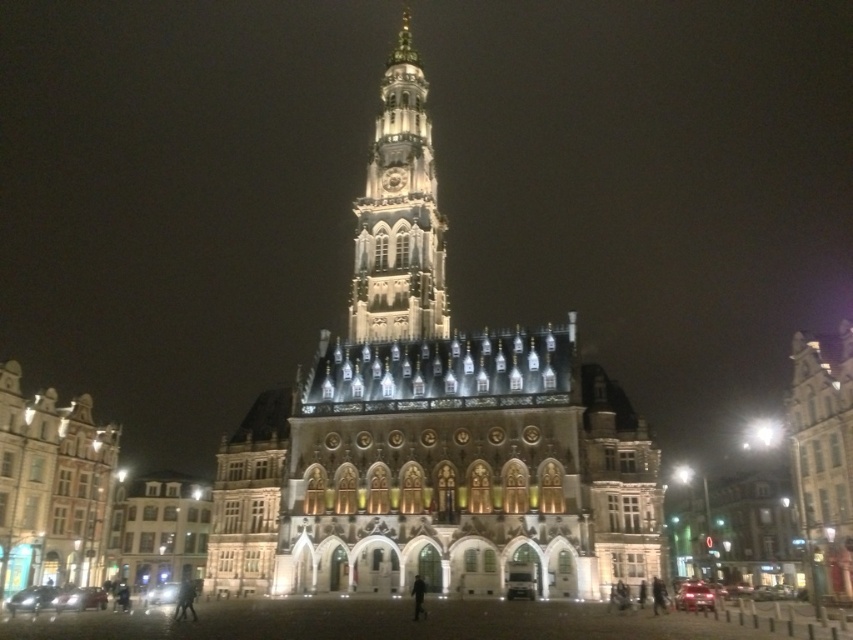
You are standing in front of the grand building and want to walk to the illuminated stone church at center. Which direction should you move relative to the polished stone town square at center?

The polished stone town square at center is to the left of the illuminated stone church at center, so you should move to the right from the polished stone town square at center to reach the illuminated stone church at center.

Based on the coordinates provided, which object is located at point (432, 428) in the scene?

The point (432, 428) indicates the illuminated stone church at center.

Based on the photo, you are a tourist standing in front of the grand illuminated building. You want to take a photo of the illuminated stone church at center and the polished stone town square at center. Which one should you zoom in on to capture more details of its architectural features?

The polished stone town square at center might be wider than the illuminated stone church at center, so you should zoom in on the illuminated stone church at center to capture more details of its architectural features.